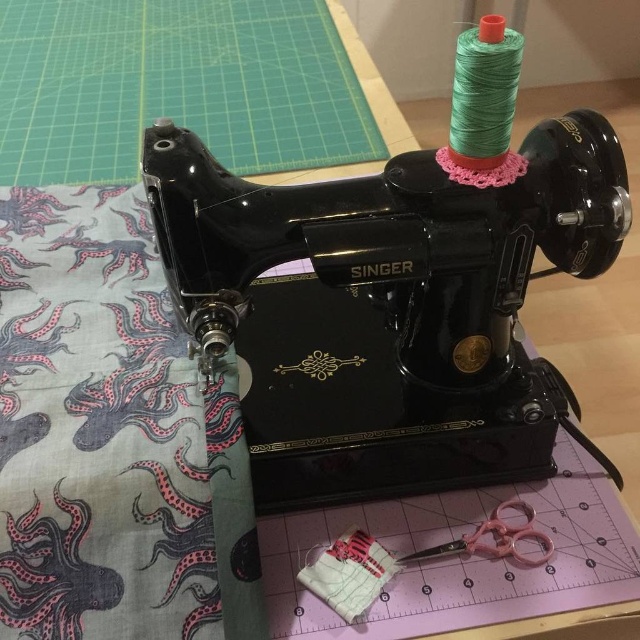
Does black glossy singer sewing machine at center have a greater height compared to pink plastic scissors at lower center?

Yes, black glossy singer sewing machine at center is taller than pink plastic scissors at lower center.

Between point (198, 284) and point (433, 547), which one is positioned behind?

The point (433, 547) is more distant.

You are a GUI agent. You are given a task and a screenshot of the screen. Output one action in this format:
    pyautogui.click(x=<x>, y=<y>)
    Task: Click on the black glossy singer sewing machine at center
    
    Given the screenshot: What is the action you would take?
    pyautogui.click(x=401, y=284)

At what (x,y) coordinates should I click in order to perform the action: click on black glossy singer sewing machine at center. Please return your answer as a coordinate pair (x, y). Looking at the image, I should click on (401, 284).